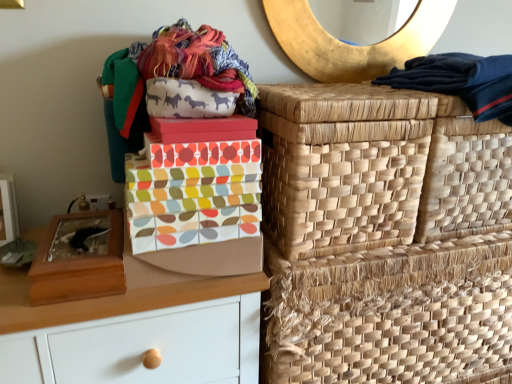
Question: Should I look upward or downward to see natural woven basket at right, which is counted as the second basket, starting from the top?

Choices:
 (A) up
 (B) down

Answer: (A)

Question: From the image's perspective, does natural woven basket at upper right, placed as the 3th basket when sorted from bottom to top, appear higher than natural woven basket at right, which is counted as the second basket, starting from the top?

Choices:
 (A) no
 (B) yes

Answer: (B)

Question: Does natural woven basket at upper right, marked as the 1th basket in a top-to-bottom arrangement, have a lesser height compared to natural woven basket at right, which ranks as the second basket in bottom-to-top order?

Choices:
 (A) yes
 (B) no

Answer: (A)

Question: Could you tell me if natural woven basket at upper right, placed as the 3th basket when sorted from bottom to top, is facing natural woven basket at right, which is counted as the second basket, starting from the top?

Choices:
 (A) yes
 (B) no

Answer: (B)

Question: Does natural woven basket at upper right, placed as the 3th basket when sorted from bottom to top, touch natural woven basket at right, which ranks as the second basket in bottom-to-top order?

Choices:
 (A) no
 (B) yes

Answer: (A)

Question: Considering the relative positions of natural woven basket at upper right, placed as the 3th basket when sorted from bottom to top, and natural woven basket at right, which is counted as the second basket, starting from the top, in the image provided, is natural woven basket at upper right, placed as the 3th basket when sorted from bottom to top, behind natural woven basket at right, which is counted as the second basket, starting from the top,?

Choices:
 (A) no
 (B) yes

Answer: (B)

Question: From a real-world perspective, is natural woven basket at upper right, marked as the 1th basket in a top-to-bottom arrangement, physically above natural woven basket at right, which ranks as the second basket in bottom-to-top order?

Choices:
 (A) yes
 (B) no

Answer: (B)

Question: Is dark blue fabric at upper right to the right of wooden shoe box at left, the 2th shoe box in the right-to-left sequence, from the viewer's perspective?

Choices:
 (A) no
 (B) yes

Answer: (B)

Question: Is dark blue fabric at upper right thinner than wooden shoe box at left, which appears as the 1th shoe box when viewed from the left?

Choices:
 (A) no
 (B) yes

Answer: (A)

Question: Can you see dark blue fabric at upper right touching wooden shoe box at left, the 2th shoe box in the right-to-left sequence?

Choices:
 (A) no
 (B) yes

Answer: (A)

Question: Is wooden shoe box at left, the 2th shoe box in the right-to-left sequence, completely or partially inside dark blue fabric at upper right?

Choices:
 (A) yes
 (B) no

Answer: (B)

Question: Considering the relative positions of dark blue fabric at upper right and wooden shoe box at left, which appears as the 1th shoe box when viewed from the left, in the image provided, is dark blue fabric at upper right to the left of wooden shoe box at left, which appears as the 1th shoe box when viewed from the left, from the viewer's perspective?

Choices:
 (A) no
 (B) yes

Answer: (A)

Question: Is dark blue fabric at upper right bigger than wooden shoe box at left, the 2th shoe box in the right-to-left sequence?

Choices:
 (A) no
 (B) yes

Answer: (B)

Question: Considering the relative sizes of dark blue fabric at upper right and multicolored fabric shoe box at center, which is the second shoe box from left to right, in the image provided, is dark blue fabric at upper right taller than multicolored fabric shoe box at center, which is the second shoe box from left to right,?

Choices:
 (A) no
 (B) yes

Answer: (B)